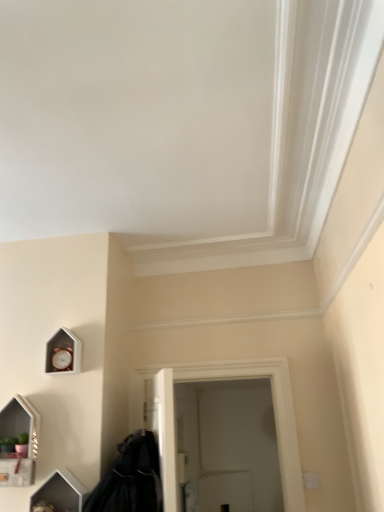
Question: In the image, is white matte door at center positioned in front of or behind black matte coat at lower left?

Choices:
 (A) front
 (B) behind

Answer: (B)

Question: Considering the positions of white matte door at center and black matte coat at lower left in the image, is white matte door at center wider or thinner than black matte coat at lower left?

Choices:
 (A) wide
 (B) thin

Answer: (B)

Question: Which object is positioned closest to the matte white medicine cabinet at lower left?

Choices:
 (A) wooden clock at lower left
 (B) white matte door at center
 (C) black matte coat at lower left
 (D) white glossy vanity at lower left

Answer: (D)

Question: Which is nearer to the white matte door at center?

Choices:
 (A) wooden clock at lower left
 (B) white glossy vanity at lower left
 (C) black matte coat at lower left
 (D) matte white medicine cabinet at lower left

Answer: (C)